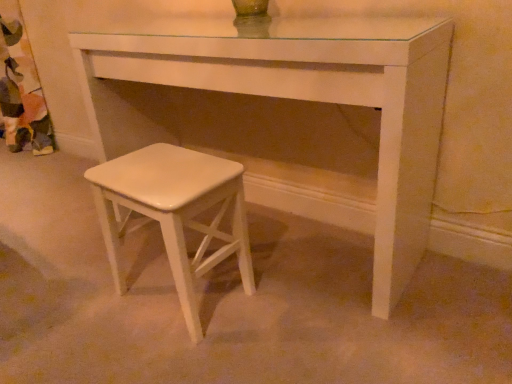
Question: Can you confirm if white glossy stool at lower left is smaller than white glossy stool at lower left?

Choices:
 (A) yes
 (B) no

Answer: (B)

Question: Is white glossy stool at lower left closer to the viewer compared to white glossy stool at lower left?

Choices:
 (A) no
 (B) yes

Answer: (B)

Question: Is white glossy stool at lower left bigger than white glossy stool at lower left?

Choices:
 (A) no
 (B) yes

Answer: (B)

Question: Could you tell me if white glossy stool at lower left is facing white glossy stool at lower left?

Choices:
 (A) yes
 (B) no

Answer: (A)

Question: Is white glossy stool at lower left further to the viewer compared to white glossy stool at lower left?

Choices:
 (A) yes
 (B) no

Answer: (B)

Question: From the image's perspective, would you say white glossy stool at lower left is positioned over white glossy stool at lower left?

Choices:
 (A) no
 (B) yes

Answer: (B)

Question: From the image's perspective, is white glossy stool at lower left on white glossy stool at lower left?

Choices:
 (A) yes
 (B) no

Answer: (B)

Question: Is white glossy stool at lower left not inside white glossy stool at lower left?

Choices:
 (A) yes
 (B) no

Answer: (A)

Question: From a real-world perspective, is white glossy stool at lower left under white glossy stool at lower left?

Choices:
 (A) no
 (B) yes

Answer: (B)

Question: Considering the relative sizes of white glossy stool at lower left and white glossy stool at lower left in the image provided, is white glossy stool at lower left bigger than white glossy stool at lower left?

Choices:
 (A) no
 (B) yes

Answer: (A)

Question: Considering the relative sizes of white glossy stool at lower left and white glossy stool at lower left in the image provided, is white glossy stool at lower left shorter than white glossy stool at lower left?

Choices:
 (A) no
 (B) yes

Answer: (B)

Question: From a real-world perspective, is white glossy stool at lower left on white glossy stool at lower left?

Choices:
 (A) yes
 (B) no

Answer: (B)

Question: Does point (110, 104) appear closer or farther from the camera than point (96, 172)?

Choices:
 (A) farther
 (B) closer

Answer: (A)